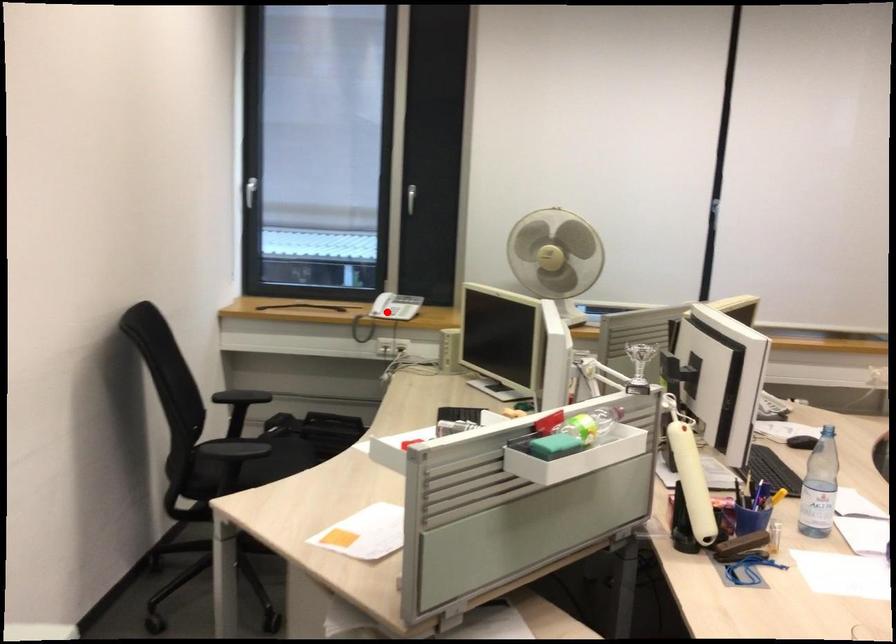
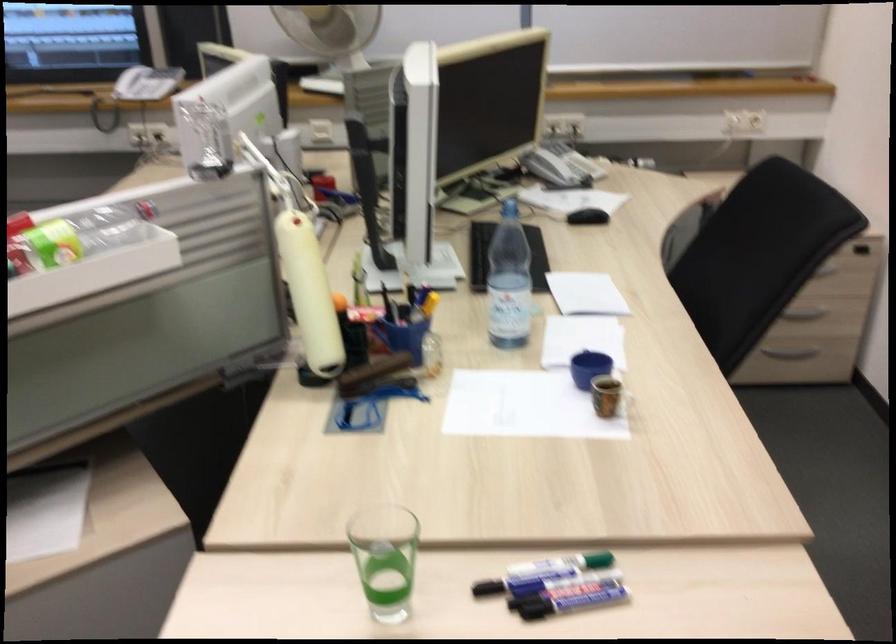
Question: I am providing you with two images of the same scene from different viewpoints. A red point is marked on the first image. Is the red point's position out of view in image 2?

Choices:
 (A) Yes
 (B) No

Answer: (A)